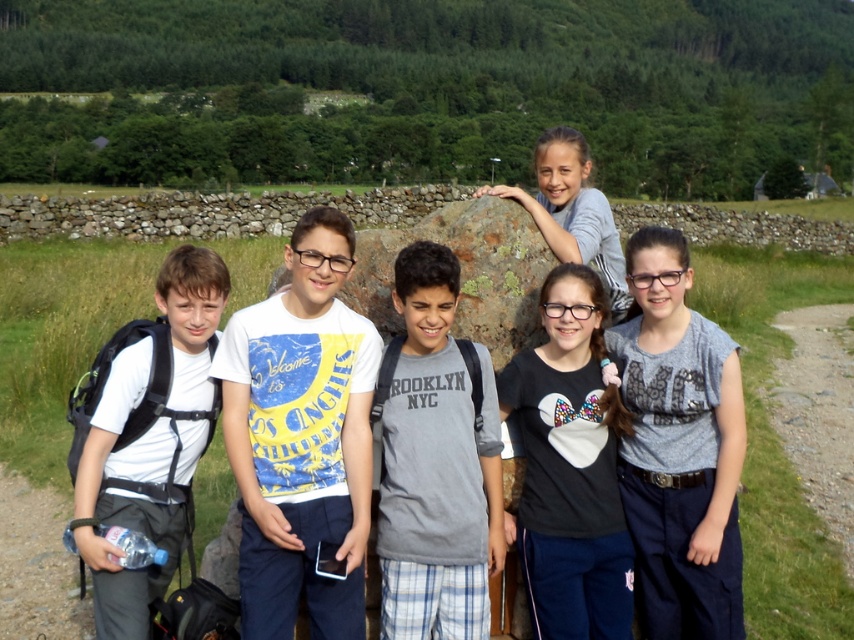
You are a photographer trying to position two markers in the scene for a group photo. The markers are placed at point (259,497) and point (515,252). Which marker is closer to the camera?

Point (259,497) is closer to the camera than point (515,252).